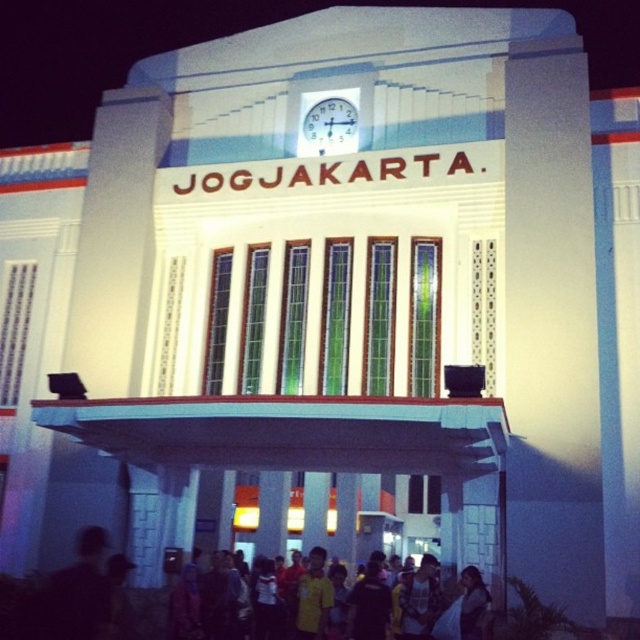
Who is positioned more to the left, yellow shirt at lower center or white plastic clock at upper center?

From the viewer's perspective, white plastic clock at upper center appears more on the left side.

Can you confirm if yellow shirt at lower center is positioned above white plastic clock at upper center?

No, yellow shirt at lower center is not above white plastic clock at upper center.

Between point (419, 614) and point (298, 138), which one is positioned in front?

Point (419, 614) is in front.

This screenshot has height=640, width=640. Identify the location of yellow shirt at lower center. (442, 605).